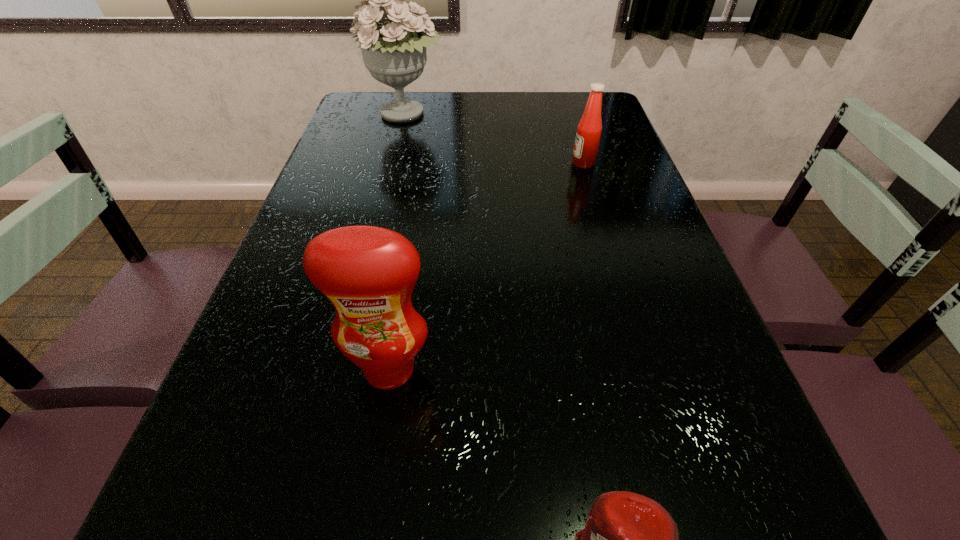
Image resolution: width=960 pixels, height=540 pixels. Find the location of `free space located 0.240m on the front-facing side of the rightmost object`. free space located 0.240m on the front-facing side of the rightmost object is located at coordinates (486, 163).

The height and width of the screenshot is (540, 960). Identify the location of object located at the far edge. (395, 53).

At what (x,y) coordinates should I click in order to perform the action: click on object situated at the left edge. Please return your answer as a coordinate pair (x, y). This screenshot has height=540, width=960. Looking at the image, I should click on (395, 53).

Find the location of a particular element. object that is at the right edge is located at coordinates [587, 140].

Find the location of a particular element. This screenshot has width=960, height=540. object present at the far left corner is located at coordinates (395, 53).

In the image, there is a desktop. Identify the location of free space at the far edge. (525, 120).

At what (x,y) coordinates should I click in order to perform the action: click on free space at the near edge of the desktop. Please return your answer as a coordinate pair (x, y). Looking at the image, I should click on (473, 539).

Find the location of a particular element. vacant area at the left edge of the desktop is located at coordinates coord(303,409).

At what (x,y) coordinates should I click in order to perform the action: click on vacant space at the right edge. Please return your answer as a coordinate pair (x, y). This screenshot has height=540, width=960. Looking at the image, I should click on (627, 174).

Image resolution: width=960 pixels, height=540 pixels. I want to click on free spot between the rightmost object and the bouquet, so click(494, 139).